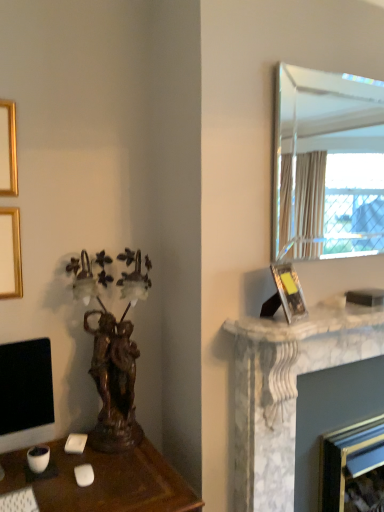
Question: Considering the relative sizes of clear glass mirror at upper right and white plastic keyboard at lower left in the image provided, is clear glass mirror at upper right smaller than white plastic keyboard at lower left?

Choices:
 (A) yes
 (B) no

Answer: (B)

Question: Does clear glass mirror at upper right turn towards white plastic keyboard at lower left?

Choices:
 (A) no
 (B) yes

Answer: (A)

Question: Does clear glass mirror at upper right have a lesser width compared to white plastic keyboard at lower left?

Choices:
 (A) no
 (B) yes

Answer: (B)

Question: From a real-world perspective, does clear glass mirror at upper right stand above white plastic keyboard at lower left?

Choices:
 (A) yes
 (B) no

Answer: (A)

Question: Considering the relative sizes of clear glass mirror at upper right and white plastic keyboard at lower left in the image provided, is clear glass mirror at upper right wider than white plastic keyboard at lower left?

Choices:
 (A) yes
 (B) no

Answer: (B)

Question: Can you confirm if clear glass mirror at upper right is positioned to the left of white plastic keyboard at lower left?

Choices:
 (A) no
 (B) yes

Answer: (A)

Question: Is clear glass mirror at upper right positioned with its back to white marble fireplace at right?

Choices:
 (A) yes
 (B) no

Answer: (B)

Question: Considering the relative sizes of clear glass mirror at upper right and white marble fireplace at right in the image provided, is clear glass mirror at upper right taller than white marble fireplace at right?

Choices:
 (A) no
 (B) yes

Answer: (B)

Question: Is clear glass mirror at upper right at the right side of white marble fireplace at right?

Choices:
 (A) no
 (B) yes

Answer: (B)

Question: Is the surface of clear glass mirror at upper right in direct contact with white marble fireplace at right?

Choices:
 (A) no
 (B) yes

Answer: (A)

Question: Is white marble fireplace at right a part of clear glass mirror at upper right?

Choices:
 (A) yes
 (B) no

Answer: (B)

Question: Is clear glass mirror at upper right in front of white marble fireplace at right?

Choices:
 (A) yes
 (B) no

Answer: (B)

Question: Is white plastic keyboard at lower left not close to white marble fireplace at right?

Choices:
 (A) yes
 (B) no

Answer: (A)